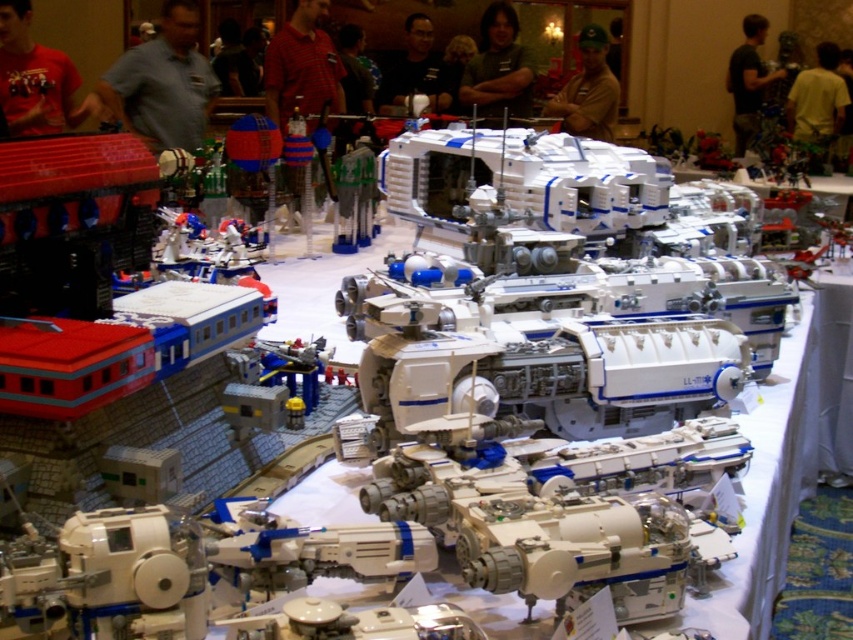
Question: Is gray shirt at upper center to the right of yellow matte shirt at upper right from the viewer's perspective?

Choices:
 (A) yes
 (B) no

Answer: (B)

Question: Which point is farther from the camera taking this photo?

Choices:
 (A) (509, 109)
 (B) (48, 102)
 (C) (593, 35)

Answer: (A)

Question: Is red plaid shirt at center behind matte black shirt at center?

Choices:
 (A) no
 (B) yes

Answer: (A)

Question: Which of the following is the farthest from the observer?

Choices:
 (A) matte black shirt at center
 (B) matte red t-shirt at upper left
 (C) brown cap at center
 (D) green shirt at center

Answer: (A)

Question: Among these objects, which one is farthest from the camera?

Choices:
 (A) matte red t-shirt at upper left
 (B) brown cap at center
 (C) gray shirt at upper center
 (D) matte black shirt at center

Answer: (D)

Question: Is red plaid shirt at center to the right of green shirt at center from the viewer's perspective?

Choices:
 (A) no
 (B) yes

Answer: (A)